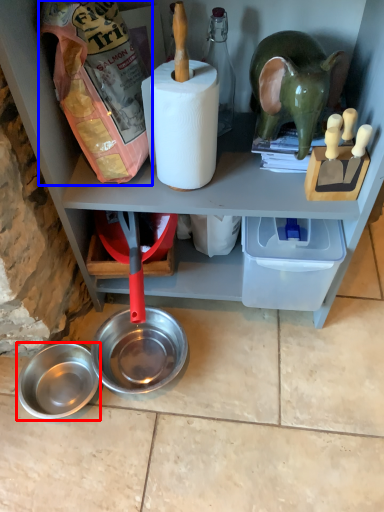
Question: Which point is closer to the camera, bowl (highlighted by a red box) or stuff (highlighted by a blue box)?

Choices:
 (A) bowl
 (B) stuff

Answer: (B)